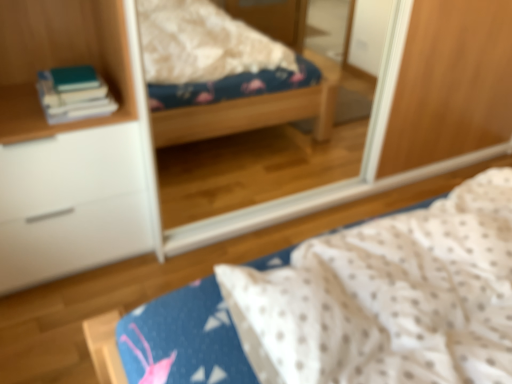
Locate an element on the screen. clear glass mirror at upper center is located at coordinates pos(249,155).

You are a GUI agent. You are given a task and a screenshot of the screen. Output one action in this format:
    pyautogui.click(x=<x>, y=<y>)
    Task: Click on the white dotted fabric at center
    The height and width of the screenshot is (384, 512).
    Given the screenshot: What is the action you would take?
    pyautogui.click(x=387, y=297)

You are a GUI agent. You are given a task and a screenshot of the screen. Output one action in this format:
    pyautogui.click(x=<x>, y=<y>)
    Task: Click on the white matte cabinet at left
    
    Given the screenshot: What is the action you would take?
    pyautogui.click(x=83, y=177)

Describe the element at coordinates (73, 94) in the screenshot. I see `hardcover books at left` at that location.

Based on the photo, measure the distance between hardcover books at left and camera.

hardcover books at left and camera are 1.49 meters apart.

Find the location of a particular element. The width and height of the screenshot is (512, 384). clear glass mirror at upper center is located at coordinates (249, 155).

Considering the positions of point (350, 308) and point (138, 164), is point (350, 308) closer or farther from the camera than point (138, 164)?

Point (350, 308).

Is white dotted fabric at center not near white matte cabinet at left?

No, white dotted fabric at center is in close proximity to white matte cabinet at left.

Which object is further away from the camera, white dotted fabric at center or white matte cabinet at left?

white matte cabinet at left is behind.

Is white dotted fabric at center facing towards white matte cabinet at left?

No, white dotted fabric at center is not aimed at white matte cabinet at left.

Is white dotted fabric at center at the back of white matte cabinet at left?

white matte cabinet at left does not have its back to white dotted fabric at center.

Does point (81, 262) appear closer or farther from the camera than point (411, 306)?

Point (81, 262) appears to be farther away from the viewer than point (411, 306).

Is white matte cabinet at left shorter than white dotted fabric at center?

No.

Which of these two, white matte cabinet at left or clear glass mirror at upper center, is wider?

Wider between the two is white matte cabinet at left.

How much distance is there between white matte cabinet at left and clear glass mirror at upper center?

white matte cabinet at left and clear glass mirror at upper center are 31.17 inches apart.

Which of these two, white matte cabinet at left or clear glass mirror at upper center, stands shorter?

With less height is white matte cabinet at left.

Identify the location of cabinetry lying on the left of clear glass mirror at upper center. Image resolution: width=512 pixels, height=384 pixels. (83, 177).

From a real-world perspective, is hardcover books at left positioned above or below white matte cabinet at left?

hardcover books at left is above white matte cabinet at left.

Is hardcover books at left not close to white matte cabinet at left?

No.

Considering the sizes of objects hardcover books at left and white matte cabinet at left in the image provided, who is smaller, hardcover books at left or white matte cabinet at left?

Smaller between the two is hardcover books at left.

From the image's perspective, is white matte cabinet at left on hardcover books at left?

No, from the image's perspective, white matte cabinet at left is not on top of hardcover books at left.

Is white matte cabinet at left aimed at hardcover books at left?

No, white matte cabinet at left is not turned towards hardcover books at left.

Considering the positions of objects white matte cabinet at left and hardcover books at left in the image provided, who is more to the right, white matte cabinet at left or hardcover books at left?

Positioned to the right is hardcover books at left.

Does point (152, 236) come farther from viewer compared to point (98, 105)?

Yes, it is.

Which of these two, white dotted fabric at center or clear glass mirror at upper center, stands shorter?

Standing shorter between the two is white dotted fabric at center.

Which point is more distant from viewer, [138,359] or [311,58]?

The point [311,58] is farther from the camera.

Is white dotted fabric at center not close to clear glass mirror at upper center?

Yes, white dotted fabric at center and clear glass mirror at upper center are located far from each other.

Can you tell me how much white dotted fabric at center and clear glass mirror at upper center differ in facing direction?

The angle between the facing direction of white dotted fabric at center and the facing direction of clear glass mirror at upper center is 180 degrees.

Does white dotted fabric at center turn towards hardcover books at left?

No.

Is white dotted fabric at center positioned far away from hardcover books at left?

Indeed, white dotted fabric at center is not near hardcover books at left.

Is white dotted fabric at center taller than hardcover books at left?

No, white dotted fabric at center is not taller than hardcover books at left.

In the image, is white dotted fabric at center on the left side or the right side of hardcover books at left?

From the image, it's evident that white dotted fabric at center is to the right of hardcover books at left.

Image resolution: width=512 pixels, height=384 pixels. I want to click on cabinetry lying on the left of white dotted fabric at center, so click(x=83, y=177).

This screenshot has height=384, width=512. I want to click on cabinetry behind the white dotted fabric at center, so click(x=83, y=177).

Looking at the image, which one is located closer to clear glass mirror at upper center, white dotted fabric at center or hardcover books at left?

hardcover books at left lies closer to clear glass mirror at upper center than the other object.

When comparing their distances from hardcover books at left, does white matte cabinet at left or white dotted fabric at center seem further?

Based on the image, white dotted fabric at center appears to be further to hardcover books at left.

Looking at the image, which one is located further to white dotted fabric at center, clear glass mirror at upper center or hardcover books at left?

clear glass mirror at upper center is positioned further to the anchor white dotted fabric at center.

Looking at the image, which one is located closer to clear glass mirror at upper center, white matte cabinet at left or hardcover books at left?

white matte cabinet at left lies closer to clear glass mirror at upper center than the other object.

From the image, which object appears to be farther from hardcover books at left, white matte cabinet at left or clear glass mirror at upper center?

clear glass mirror at upper center.

Looking at this image, looking at the image, which one is located further to clear glass mirror at upper center, hardcover books at left or white dotted fabric at center?

white dotted fabric at center lies further to clear glass mirror at upper center than the other object.

Estimate the real-world distances between objects in this image. Which object is further from white matte cabinet at left, hardcover books at left or clear glass mirror at upper center?

The object further to white matte cabinet at left is clear glass mirror at upper center.

Based on their spatial positions, is hardcover books at left or white matte cabinet at left closer to clear glass mirror at upper center?

The object closer to clear glass mirror at upper center is white matte cabinet at left.

The height and width of the screenshot is (384, 512). What are the coordinates of `bed between white matte cabinet at left and clear glass mirror at upper center in the horizontal direction` in the screenshot? It's located at (387, 297).

Identify the location of book between white matte cabinet at left and white dotted fabric at center from left to right. Image resolution: width=512 pixels, height=384 pixels. (73, 94).

Identify the location of bed between hardcover books at left and clear glass mirror at upper center from left to right. This screenshot has height=384, width=512. (387, 297).

Locate an element on the screen. This screenshot has width=512, height=384. book between white matte cabinet at left and clear glass mirror at upper center is located at coordinates (73, 94).